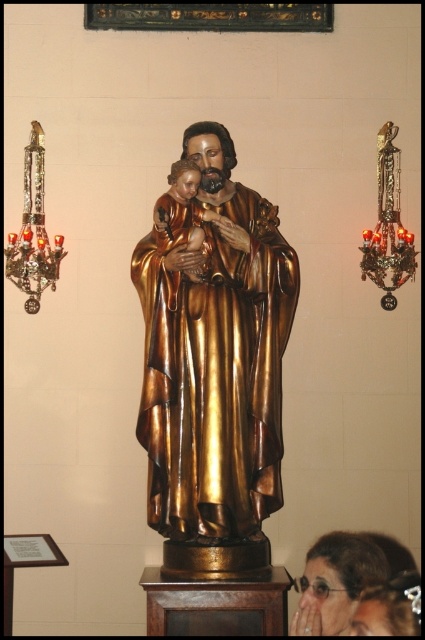
Based on the scene description, where is the gold polished wood statue at center located in terms of its 2D coordinates?

The gold polished wood statue at center is located at the 2D coordinates point (212, 362).

You are an art curator planning to display both the gold polished wood statue at center and the matte gold statue at center in a gallery. Given their sizes, which statue will require more floor space for proper display?

The gold polished wood statue at center requires more floor space because it is larger in size than the matte gold statue at center.